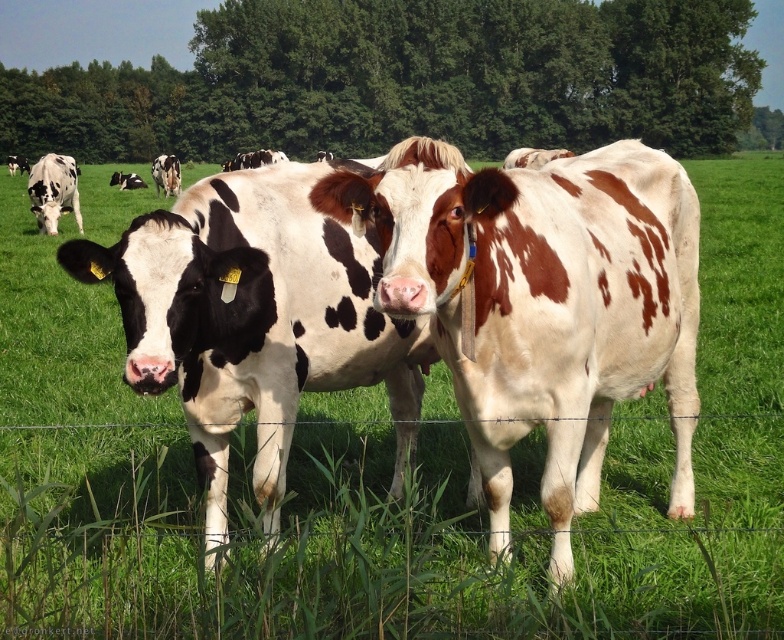
You are standing in the field and want to walk towards the two points marked in the image. Which point, point (60, 204) or point (173, 173), will you reach first?

Point (60, 204) is closer to the camera than point (173, 173), so you will reach point (60, 204) first.

You are a farmer checking the herd. You notice two cows, the brown spotted cow at center and the black and white spotted cow at upper left. Which cow would appear larger to you from your current viewpoint?

The brown spotted cow at center appears larger because it is closer to the viewer than the black and white spotted cow at upper left.

You are a farmer who needs to fit both the brown spotted cow at center and the black and white spotted cow at left into a pen that can only accommodate animals up to the size of the smaller cow. Which cow will not fit in the pen?

The brown spotted cow at center will not fit in the pen because its width is larger than the black and white spotted cow at left, which is the smaller one.